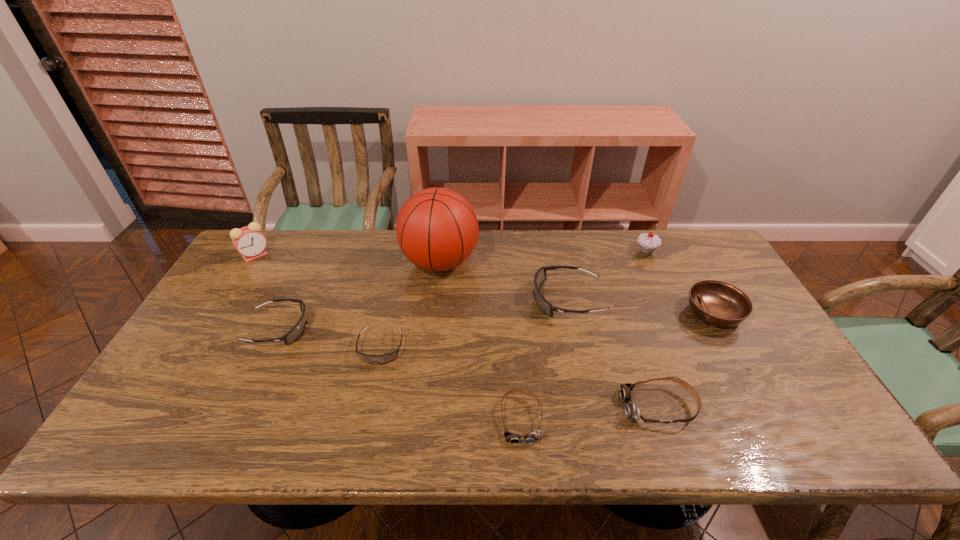
Where is `the second black goggles from left to right`? the second black goggles from left to right is located at coordinates (388, 357).

Where is `the smallest black goggles`? The height and width of the screenshot is (540, 960). the smallest black goggles is located at coordinates (388, 357).

You are a GUI agent. You are given a task and a screenshot of the screen. Output one action in this format:
    pyautogui.click(x=<x>, y=<y>)
    Task: Click on the smaller brown goggles
    
    Given the screenshot: What is the action you would take?
    pyautogui.click(x=512, y=438)

Locate an element on the screen. This screenshot has width=960, height=540. the left brown goggles is located at coordinates (512, 438).

The image size is (960, 540). Identify the location of vacant region located 0.250m on the right of the tallest object. (556, 262).

At what (x,y) coordinates should I click in order to perform the action: click on free region located on the left of the cupcake. Please return your answer as a coordinate pair (x, y). Looking at the image, I should click on (x=566, y=251).

Locate an element on the screen. This screenshot has height=540, width=960. free location located 0.180m on the face of the pink alarm clock is located at coordinates (227, 302).

At what (x,y) coordinates should I click in order to perform the action: click on blank space located on the lenses of the tallest goggles. Please return your answer as a coordinate pair (x, y). Looking at the image, I should click on (397, 300).

This screenshot has width=960, height=540. In order to click on free space located on the lenses of the tallest goggles in this screenshot , I will do `click(512, 300)`.

The height and width of the screenshot is (540, 960). Identify the location of vacant space located on the lenses of the tallest goggles. (495, 300).